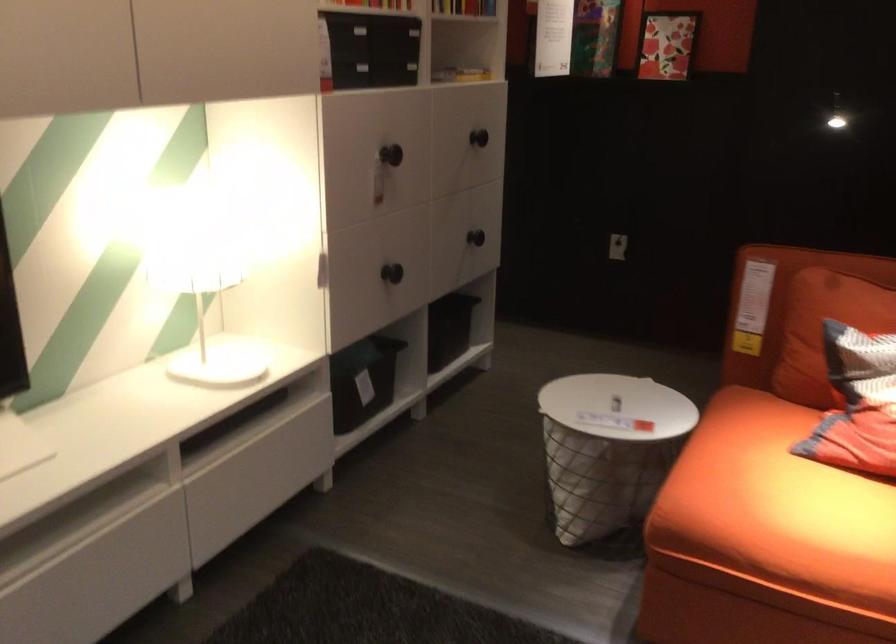
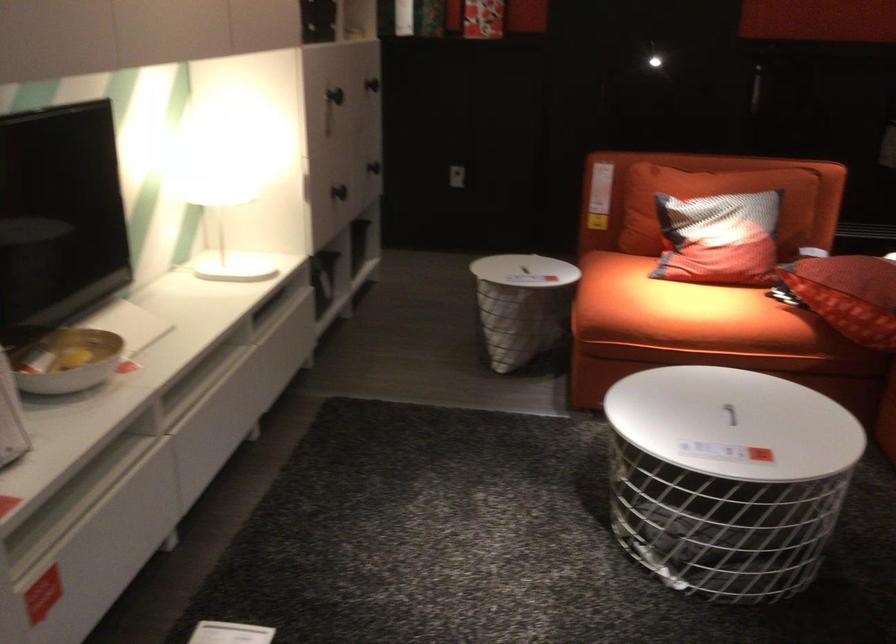
In the second image, find the point that corresponds to pixel 478 136 in the first image.

(372, 84)